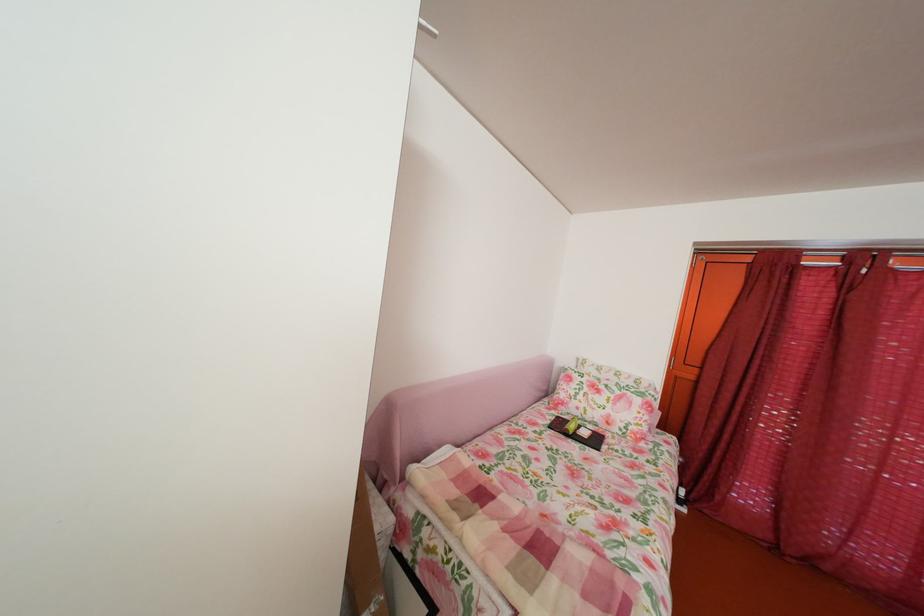
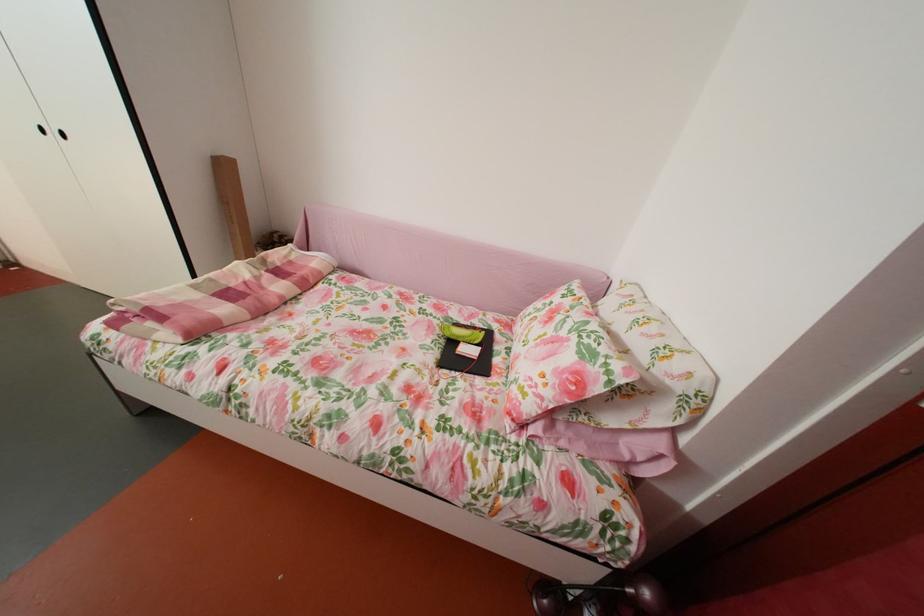
Locate, in the second image, the point that corresponds to (x=561, y=429) in the first image.

(473, 328)